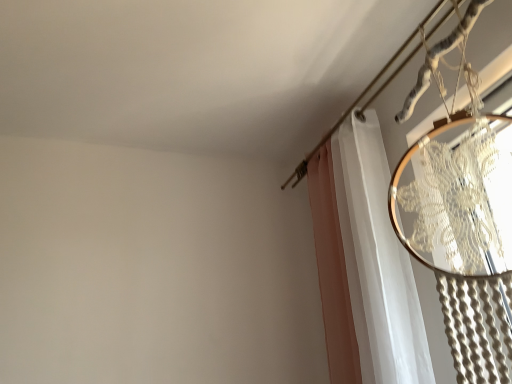
At what (x,y) coordinates should I click in order to perform the action: click on white sheer curtain at upper right. Please return your answer as a coordinate pair (x, y). Looking at the image, I should click on (364, 263).

What do you see at coordinates (364, 263) in the screenshot? I see `white sheer curtain at upper right` at bounding box center [364, 263].

Where is `metallic silver clothesline at upper right`? metallic silver clothesline at upper right is located at coordinates (357, 102).

Describe the element at coordinates (357, 102) in the screenshot. The image size is (512, 384). I see `metallic silver clothesline at upper right` at that location.

What is the approximate height of metallic silver clothesline at upper right?

The height of metallic silver clothesline at upper right is 5.69 centimeters.

This screenshot has height=384, width=512. I want to click on white sheer curtain at upper right, so click(364, 263).

Is white sheer curtain at upper right at the left side of metallic silver clothesline at upper right?

Correct, you'll find white sheer curtain at upper right to the left of metallic silver clothesline at upper right.

Considering the positions of objects white sheer curtain at upper right and metallic silver clothesline at upper right in the image provided, who is in front, white sheer curtain at upper right or metallic silver clothesline at upper right?

metallic silver clothesline at upper right is in front.

Is point (406, 355) closer to camera compared to point (378, 77)?

Yes, point (406, 355) is in front of point (378, 77).

Based on the photo, from the image's perspective, is white sheer curtain at upper right under metallic silver clothesline at upper right?

Yes, from the image's perspective, white sheer curtain at upper right is below metallic silver clothesline at upper right.

From a real-world perspective, who is located lower, white sheer curtain at upper right or metallic silver clothesline at upper right?

In real-world perspective, white sheer curtain at upper right is lower.

Which of these two, white sheer curtain at upper right or metallic silver clothesline at upper right, is thinner?

white sheer curtain at upper right is thinner.

Who is taller, white sheer curtain at upper right or metallic silver clothesline at upper right?

Standing taller between the two is white sheer curtain at upper right.

Based on the photo, based on their sizes in the image, would you say white sheer curtain at upper right is bigger or smaller than metallic silver clothesline at upper right?

In the image, white sheer curtain at upper right appears to be larger than metallic silver clothesline at upper right.

Would you say white sheer curtain at upper right is outside metallic silver clothesline at upper right?

Yes, white sheer curtain at upper right is outside of metallic silver clothesline at upper right.

Is white sheer curtain at upper right not near metallic silver clothesline at upper right?

No.

Is metallic silver clothesline at upper right at the back of white sheer curtain at upper right?

No, metallic silver clothesline at upper right is not at the back of white sheer curtain at upper right.

Can you tell me how much white sheer curtain at upper right and metallic silver clothesline at upper right differ in facing direction?

They differ by 0.0644 degrees in their facing directions.

How distant is white sheer curtain at upper right from metallic silver clothesline at upper right?

white sheer curtain at upper right is 19.84 inches from metallic silver clothesline at upper right.

The width and height of the screenshot is (512, 384). Find the location of `curtain below the metallic silver clothesline at upper right (from the image's perspective)`. curtain below the metallic silver clothesline at upper right (from the image's perspective) is located at coordinates (364, 263).

Which is more to the right, metallic silver clothesline at upper right or white sheer curtain at upper right?

From the viewer's perspective, metallic silver clothesline at upper right appears more on the right side.

Is metallic silver clothesline at upper right positioned behind white sheer curtain at upper right?

No, it is in front of white sheer curtain at upper right.

Which is closer, (340, 120) or (351, 155)?

Clearly, point (340, 120) is more distant from the camera than point (351, 155).

Based on the photo, from the image's perspective, is metallic silver clothesline at upper right above or below white sheer curtain at upper right?

metallic silver clothesline at upper right is situated higher than white sheer curtain at upper right in the image.

From a real-world perspective, is metallic silver clothesline at upper right physically below white sheer curtain at upper right?

Actually, metallic silver clothesline at upper right is physically above white sheer curtain at upper right in the real world.

Can you confirm if metallic silver clothesline at upper right is thinner than white sheer curtain at upper right?

No.

Who is shorter, metallic silver clothesline at upper right or white sheer curtain at upper right?

With less height is metallic silver clothesline at upper right.

Which of these two, metallic silver clothesline at upper right or white sheer curtain at upper right, is bigger?

Bigger between the two is white sheer curtain at upper right.

In the scene shown: Can we say metallic silver clothesline at upper right lies outside white sheer curtain at upper right?

No.

From the picture: Is metallic silver clothesline at upper right touching white sheer curtain at upper right?

metallic silver clothesline at upper right is not next to white sheer curtain at upper right, and they're not touching.

Is metallic silver clothesline at upper right oriented away from white sheer curtain at upper right?

Correct, metallic silver clothesline at upper right is looking away from white sheer curtain at upper right.

How distant is metallic silver clothesline at upper right from white sheer curtain at upper right?

The distance of metallic silver clothesline at upper right from white sheer curtain at upper right is 19.84 inches.

The image size is (512, 384). What are the coordinates of `curtain behind the metallic silver clothesline at upper right` in the screenshot? It's located at (364, 263).

This screenshot has width=512, height=384. I want to click on curtain below the metallic silver clothesline at upper right (from a real-world perspective), so click(x=364, y=263).

Locate an element on the screen. curtain below the metallic silver clothesline at upper right (from the image's perspective) is located at coordinates (364, 263).